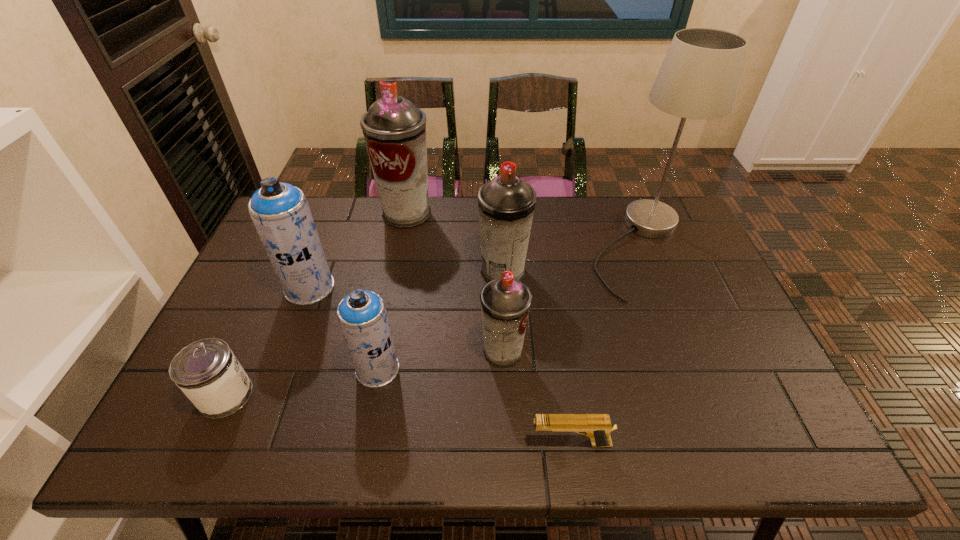
Where is `vacant space in between the tallest aerosol can and the right blue aerosol can`? The width and height of the screenshot is (960, 540). vacant space in between the tallest aerosol can and the right blue aerosol can is located at coordinates (393, 291).

Identify the location of vacant region between the smallest gray aerosol can and the white table lamp. The width and height of the screenshot is (960, 540). (572, 300).

Where is `free space between the biggest gray aerosol can and the bigger blue aerosol can`? free space between the biggest gray aerosol can and the bigger blue aerosol can is located at coordinates (358, 251).

You are a GUI agent. You are given a task and a screenshot of the screen. Output one action in this format:
    pyautogui.click(x=<x>, y=<y>)
    Task: Click on the free space between the pistol and the white table lamp
    This screenshot has height=540, width=960.
    Given the screenshot: What is the action you would take?
    pyautogui.click(x=606, y=346)

This screenshot has width=960, height=540. What are the coordinates of `object that is the fifth closest to the nearest gray aerosol can` in the screenshot? It's located at (280, 212).

Locate which object ranks second in proximity to the second shortest object. Please provide its 2D coordinates. Your answer should be formatted as a tuple, i.e. [(x, y)], where the tuple contains the x and y coordinates of a point satisfying the conditions above.

[(362, 316)]

You are a GUI agent. You are given a task and a screenshot of the screen. Output one action in this format:
    pyautogui.click(x=<x>, y=<y>)
    Task: Click on the aerosol can that stands as the closest to the tallest aerosol can
    Image resolution: width=960 pixels, height=540 pixels.
    Given the screenshot: What is the action you would take?
    pyautogui.click(x=506, y=204)

Select which aerosol can appears as the closest to the nearer blue aerosol can. Please provide its 2D coordinates. Your answer should be formatted as a tuple, i.e. [(x, y)], where the tuple contains the x and y coordinates of a point satisfying the conditions above.

[(280, 212)]

Identify which gray aerosol can is the nearest to the bigger blue aerosol can. Please provide its 2D coordinates. Your answer should be formatted as a tuple, i.e. [(x, y)], where the tuple contains the x and y coordinates of a point satisfying the conditions above.

[(394, 129)]

Locate which gray aerosol can is the closest to the shortest object. Please provide its 2D coordinates. Your answer should be formatted as a tuple, i.e. [(x, y)], where the tuple contains the x and y coordinates of a point satisfying the conditions above.

[(505, 302)]